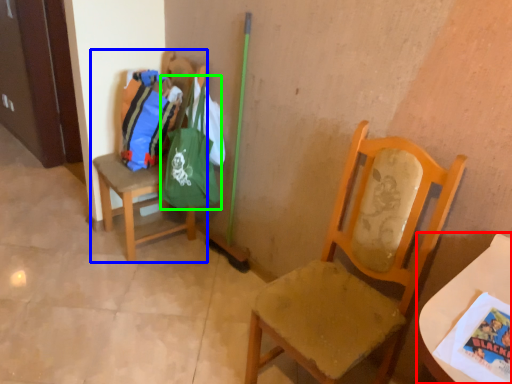
Question: Estimate the real-world distances between objects in this image. Which object is closer to table (highlighted by a red box), chair (highlighted by a blue box) or bag (highlighted by a green box)?

Choices:
 (A) chair
 (B) bag

Answer: (B)